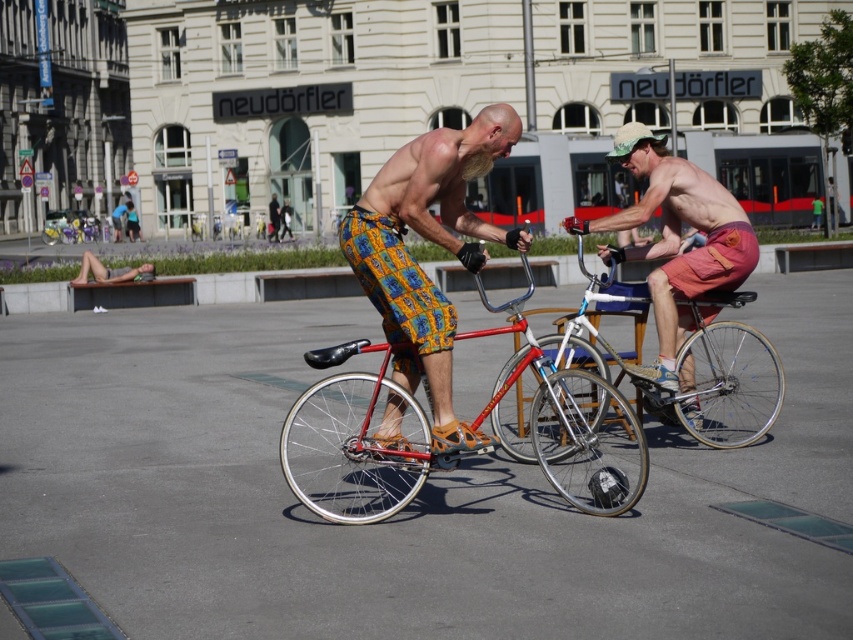
Can you confirm if shiny metallic bicycle at center is smaller than yellow patterned shorts at center?

Incorrect, shiny metallic bicycle at center is not smaller in size than yellow patterned shorts at center.

Does point (320, 486) lie in front of point (410, 321)?

No, (320, 486) is behind (410, 321).

The height and width of the screenshot is (640, 853). I want to click on shiny metallic bicycle at center, so click(x=352, y=442).

Is shiny metallic bicycle at center wider than shiny silver bicycle at center?

Indeed, shiny metallic bicycle at center has a greater width compared to shiny silver bicycle at center.

Can you confirm if shiny metallic bicycle at center is positioned to the right of shiny silver bicycle at center?

Incorrect, shiny metallic bicycle at center is not on the right side of shiny silver bicycle at center.

Where is `shiny metallic bicycle at center`? shiny metallic bicycle at center is located at coordinates (352, 442).

Between yellow patterned shorts at center and shiny silver bicycle at center, which one is positioned higher?

yellow patterned shorts at center

Is yellow patterned shorts at center thinner than shiny silver bicycle at center?

→ Yes, yellow patterned shorts at center is thinner than shiny silver bicycle at center.

Is point (523, 250) in front of point (699, 339)?

Yes, it is.

You are a GUI agent. You are given a task and a screenshot of the screen. Output one action in this format:
    pyautogui.click(x=<x>, y=<y>)
    Task: Click on the yellow patterned shorts at center
    
    Given the screenshot: What is the action you would take?
    pyautogui.click(x=432, y=241)